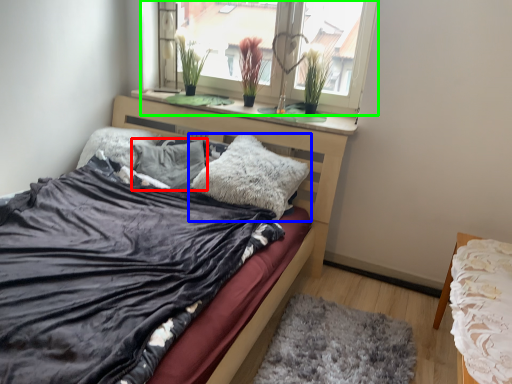
Question: Based on their relative distances, which object is nearer to pillow (highlighted by a red box)? Choose from pillow (highlighted by a blue box) and window (highlighted by a green box).

Choices:
 (A) pillow
 (B) window

Answer: (A)